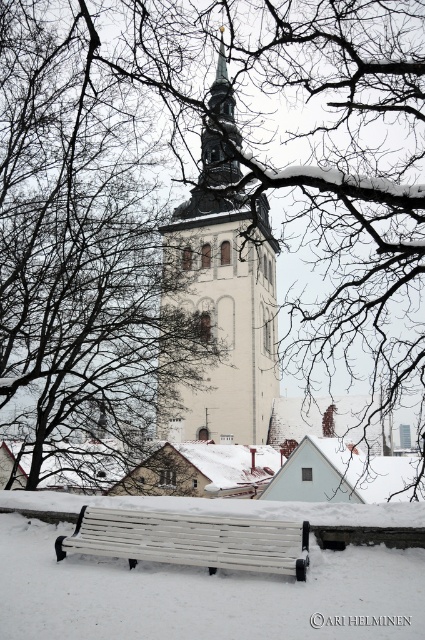
You are standing in a snowy winter scene and want to take a photo of the gray stone tower at center. If you are exactly 26.18 meters away from it, will you be able to capture the entire tower in your camera frame without moving closer or farther?

Yes, since you are exactly 26.18 meters away from the gray stone tower at center, which is the required distance to capture the entire tower in your camera frame without needing to adjust your position.

You are an architect analyzing the winter scene. You need to determine if the gray stone tower at center can be seen in full from the position of the white wooden bench at lower center. Based on their sizes and positions, what do you conclude?

The gray stone tower at center is larger in size than the white wooden bench at lower center. Since the tower is positioned at the center and is much taller, it is likely that the entire tower can be seen from the bench at lower center unless there are obstructions like trees or walls. However, the scene description mentions only bare tree branches framing the scene, which might not fully block the view. Therefore, the tower is probably visible in full from the bench.

You are standing in the winter scene and want to walk from the gray stone tower at center to the white wooden bench at lower center. Which direction should you move relative to the tower?

You should move forward towards the white wooden bench at lower center because it is closer to the viewer than the gray stone tower at center, which is further away.